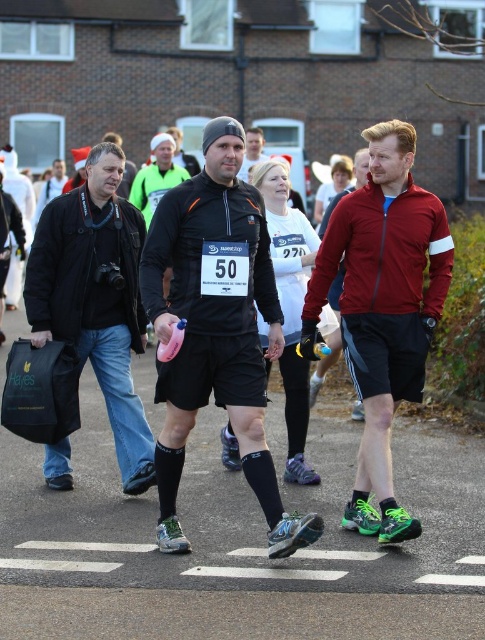
Based on the scene description, which object is taller between the matte black shorts at center and the black matte jacket at left?

The matte black shorts at center is taller than the black matte jacket at left according to the description.

You are a photographer at the charity run event. You need to position your camera to capture the matte black shorts at center. What are the coordinates where you should aim your camera?

The coordinates for the matte black shorts at center are at point [215,330].

You are a photographer at the charity run event. You need to take a photo that includes both the matte black shorts at center and the black matte running shorts at center. Which one should you adjust your camera angle to focus on first if you want to capture both in the frame?

The matte black shorts at center is positioned on the left side of black matte running shorts at center. To capture both in the frame, adjust your camera angle to focus on the matte black shorts at center first as it is on the left, then pan to include the black matte running shorts at center on the right.